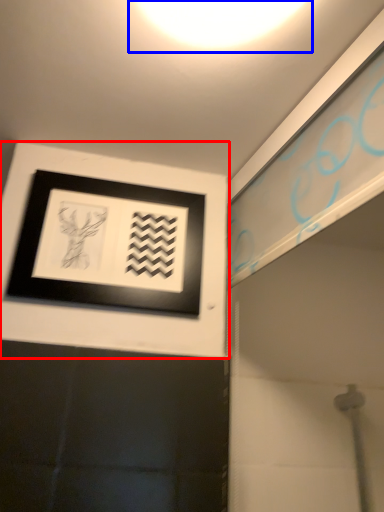
Question: Which of the following is the farthest to the observer, picture frame (highlighted by a red box) or light (highlighted by a blue box)?

Choices:
 (A) picture frame
 (B) light

Answer: (A)